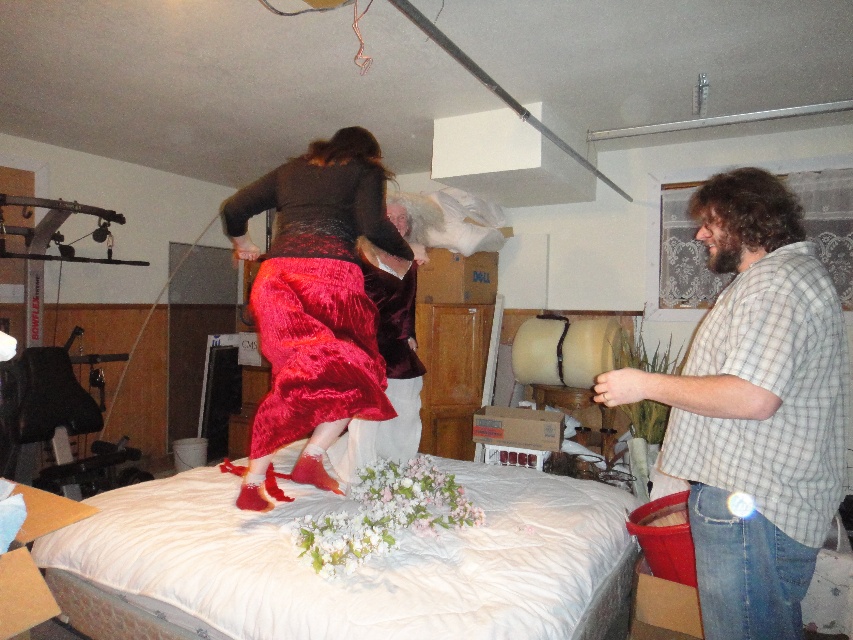
You are a photographer standing in the room and want to capture a photo that includes both the white fabric bed at center and the checkered shirt at right. Which object should you focus on first to ensure both are in frame?

You should focus on the white fabric bed at center first because it is closer to you than the checkered shirt at right, ensuring both are in frame.

Consider the image. You are holding a camera and want to take a photo of the white fabric bed at center. If you are standing 5 feet away from it, will you be able to capture the entire bed in your shot?

The white fabric bed at center and camera are 5.43 feet apart from each other. Since you are standing 5 feet away, you are closer than the required distance of 5.43 feet to capture the entire bed, so you might need to step back a bit to include the whole bed in your photo.

You are organizing a costume party and need to decide which item to place on a small shelf. Given the checkered shirt at right and the velvet red skirt at center, which item would fit better on the shelf?

The checkered shirt at right is smaller than the velvet red skirt at center, so it would fit better on the small shelf.